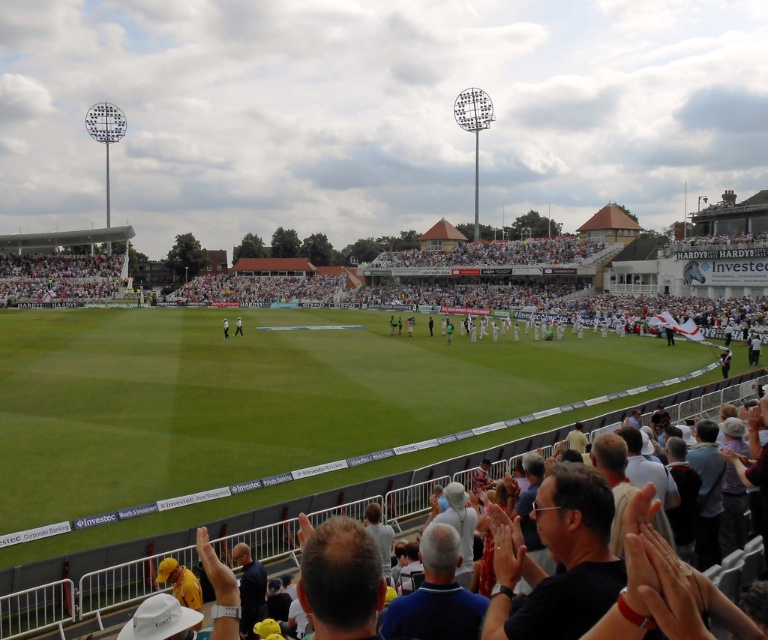
You are a photographer positioned at the edge of the cricket field. You need to capture a clear photo of the light brown leather jacket at center without the white fabric crowd at upper left blocking it. What adjustment should you make to your camera angle?

To avoid the white fabric crowd at upper left blocking the light brown leather jacket at center, you should lower your camera angle since the white fabric crowd at upper left is taller than the light brown leather jacket at center.

You are a photographer trying to capture a photo of the cricket match. You notice the white fabric crowd at upper left and the white fabric person at center. Which one would appear bigger in your photo?

The white fabric crowd at upper left would appear bigger in the photo because it is larger in size than the white fabric person at center.

You are a photographer trying to capture a photo of the cricket match. You notice two subjects in the center of the field, a light brown leather jacket at center and a white fabric person at center. Which subject should you focus on if you want to capture the larger object in your shot?

The white fabric person at center is larger than the light brown leather jacket at center, so you should focus on the white fabric person at center to capture the larger object in your shot.